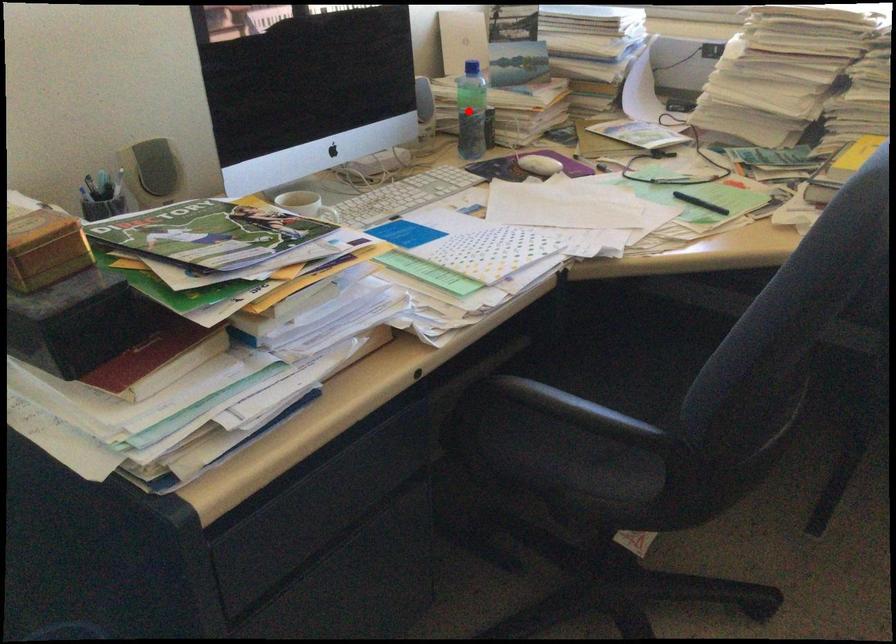
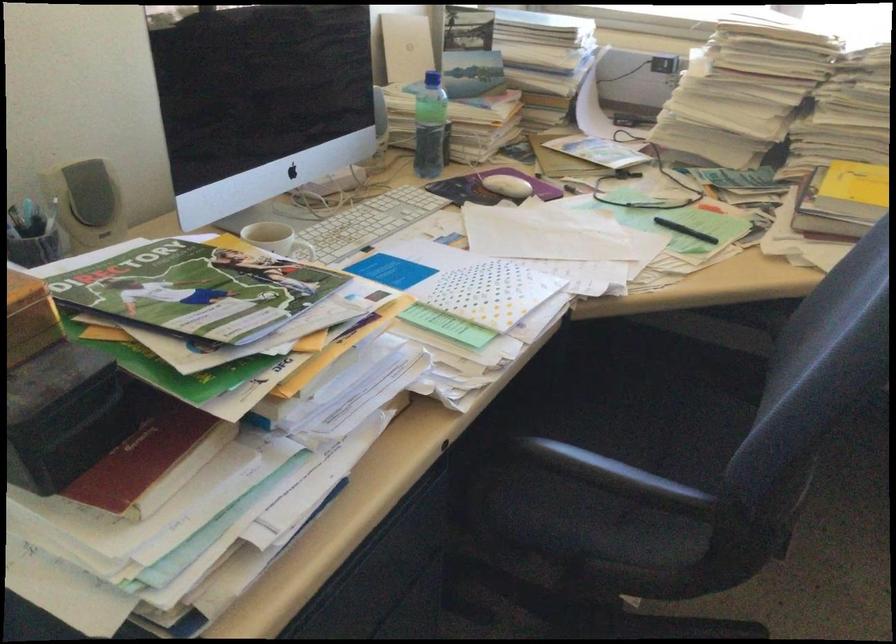
Where in the second image is the point corresponding to the highlighted location from the first image?

(428, 126)